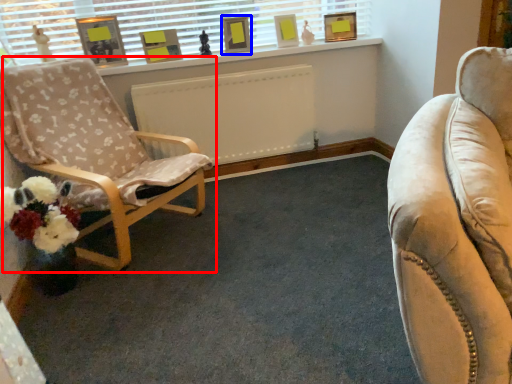
Question: Which object appears closest to the camera in this image, chair (highlighted by a red box) or picture frame (highlighted by a blue box)?

Choices:
 (A) chair
 (B) picture frame

Answer: (A)